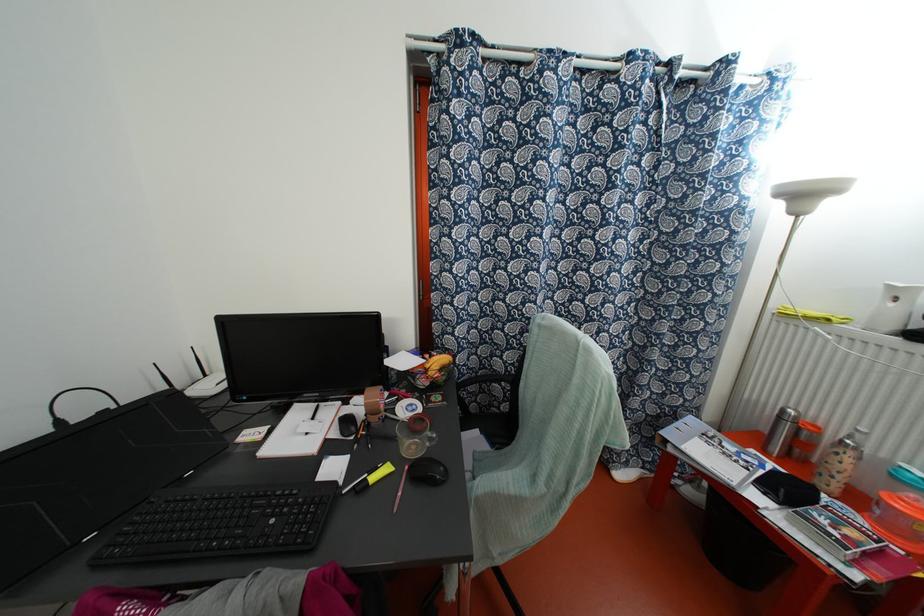
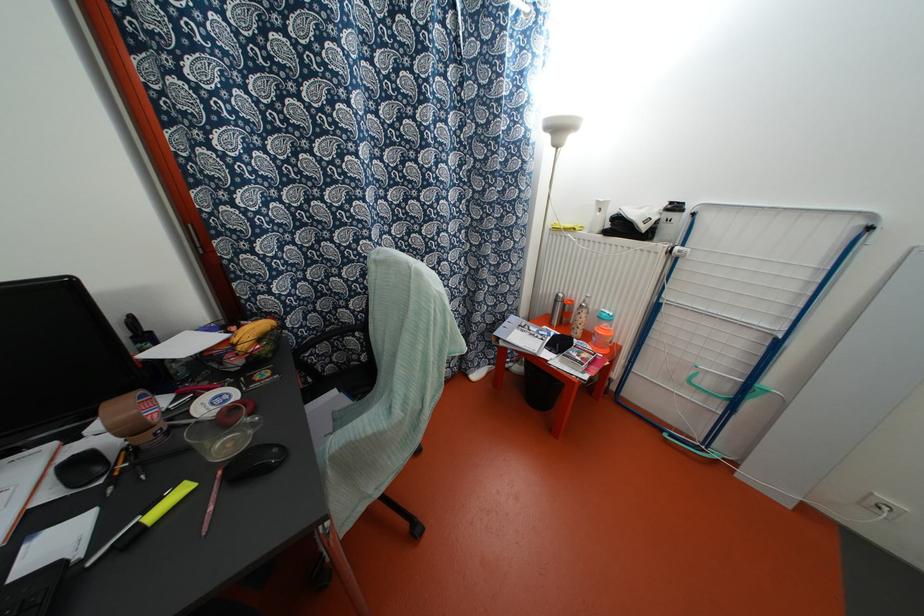
The point at (x=724, y=496) is marked in the first image. Where is the corresponding point in the second image?

(531, 362)